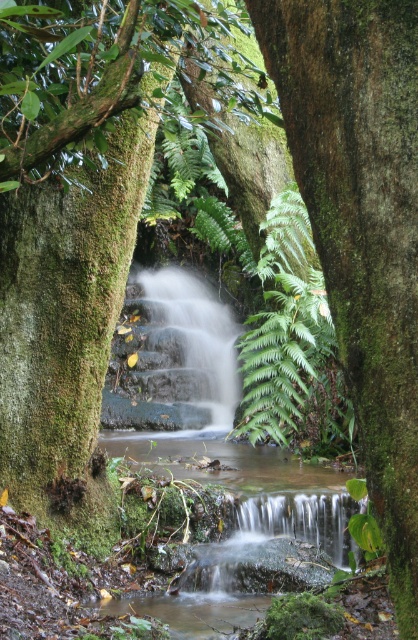
Does point (407, 61) come behind point (275, 289)?

No, it is in front of (275, 289).

From the picture: Is green mossy tree trunk at center below green leafy fern at center?

Yes.

Is point (352, 244) less distant than point (277, 388)?

Yes.

This screenshot has height=640, width=418. What are the coordinates of `green mossy tree trunk at center` in the screenshot? It's located at (361, 225).